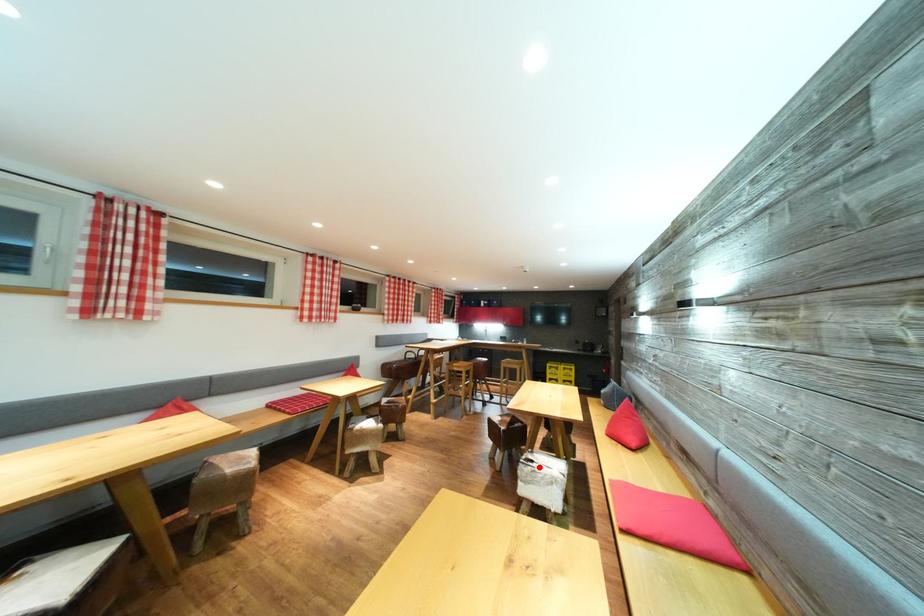
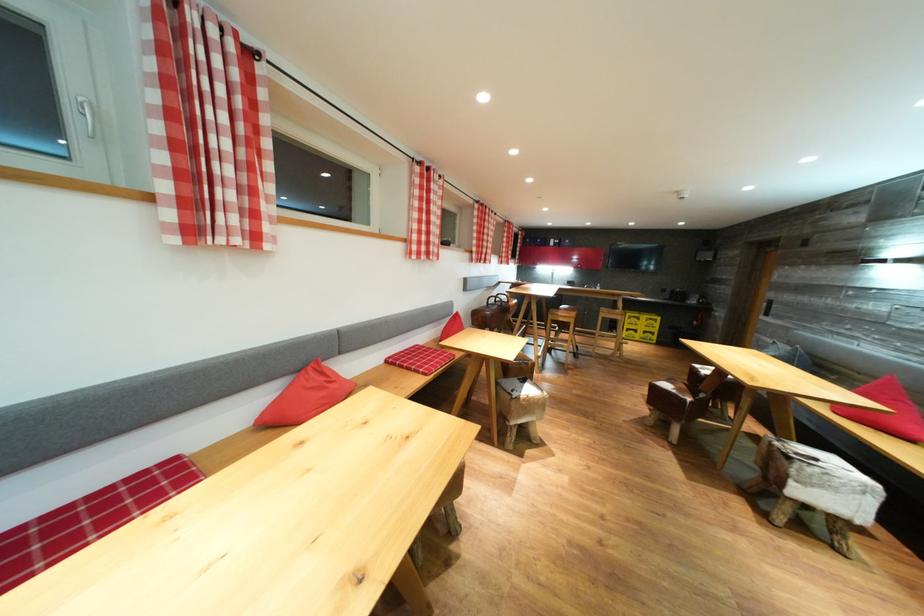
Where in the second image is the point corresponding to the highlighted location from the first image?

(821, 464)